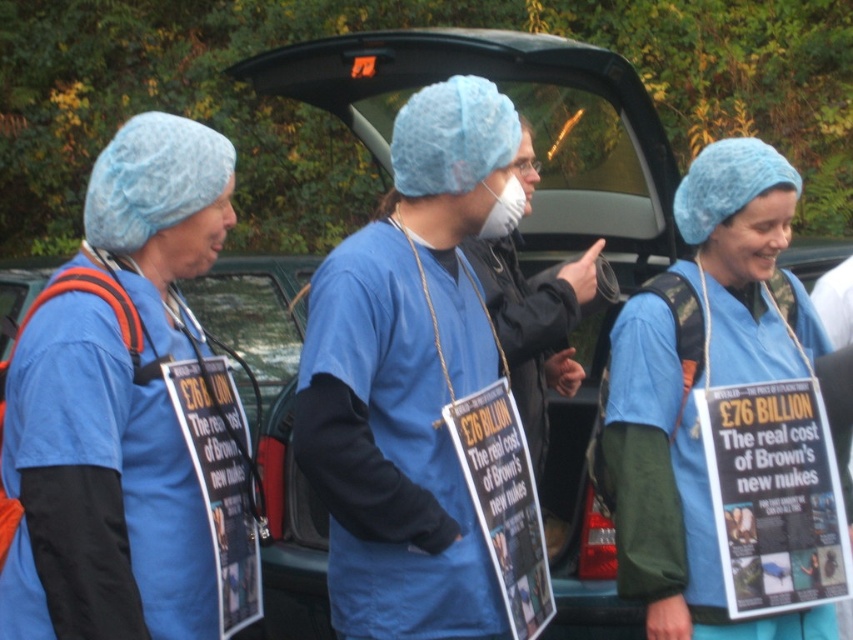
Does point (53, 532) lie in front of point (666, 531)?

Yes, point (53, 532) is in front of point (666, 531).

Which is in front, point (16, 497) or point (671, 268)?

Point (16, 497) is in front.

Is point (76, 356) in front of point (639, 541)?

Yes, it is in front of point (639, 541).

This screenshot has height=640, width=853. Find the location of `matte blue hairnet at left`. matte blue hairnet at left is located at coordinates (97, 492).